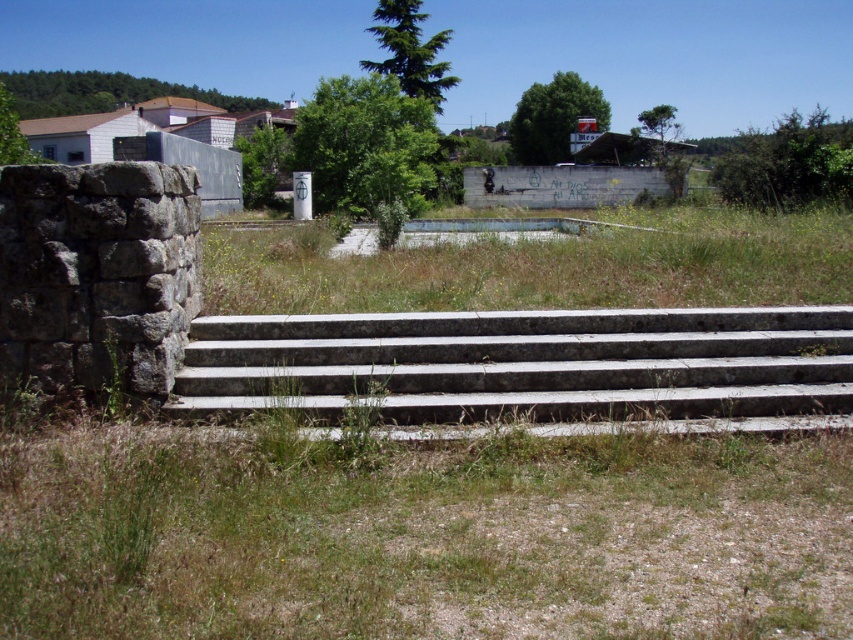
You are a gardener trying to mow the green grass at center. However, you notice the gray concrete stairs at center nearby. Considering their height, will the grass be taller than the stairs?

The gray concrete stairs at center is not as tall as green grass at center, so yes, the grass is taller than the stairs.

You are a gardener trying to mow the green grass at center. There are gray concrete stairs at center in the way. Can you mow the grass without stepping on the stairs?

The gray concrete stairs at center is positioned under green grass at center, so you can mow the grass without stepping on the stairs since the stairs are beneath the grass area.